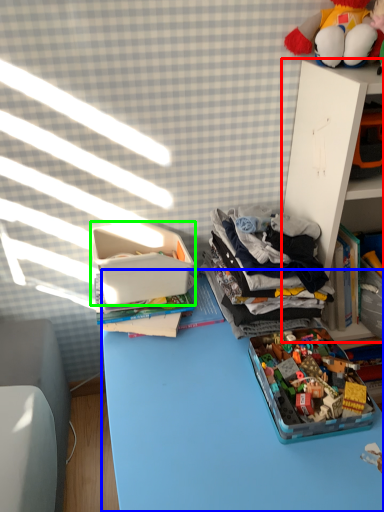
Question: Based on their relative distances, which object is farther from shelf (highlighted by a red box)? Choose from desk (highlighted by a blue box) and storage box (highlighted by a green box).

Choices:
 (A) desk
 (B) storage box

Answer: (A)